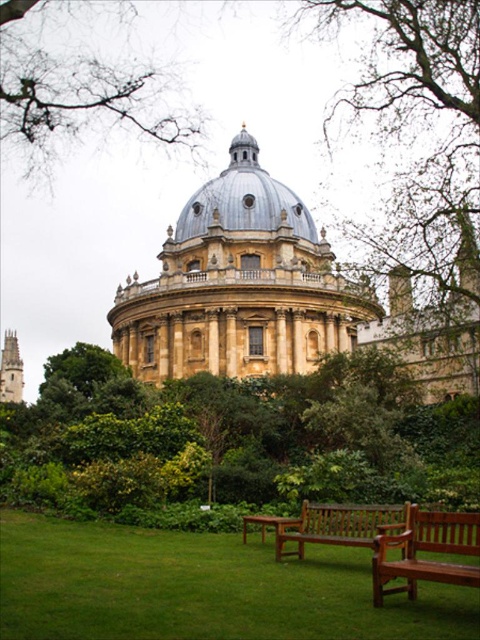
Is point (116, 440) in front of point (340, 525)?

No, (116, 440) is behind (340, 525).

You are a GUI agent. You are given a task and a screenshot of the screen. Output one action in this format:
    pyautogui.click(x=<x>, y=<y>)
    Task: Click on the green leafy tree at center
    The image size is (480, 640).
    Given the screenshot: What is the action you would take?
    pyautogui.click(x=255, y=428)

Which of these two, green leafy tree at center or smooth beige dome at center, stands shorter?

Standing shorter between the two is green leafy tree at center.

Does green leafy tree at center lie behind smooth beige dome at center?

No, green leafy tree at center is in front of smooth beige dome at center.

Identify the location of green leafy tree at center. (255, 428).

From the picture: Which of these two, green leafy tree at center or golden stone dome at center, stands taller?

golden stone dome at center is taller.

Where is `green leafy tree at center`? This screenshot has height=640, width=480. green leafy tree at center is located at coordinates (255, 428).